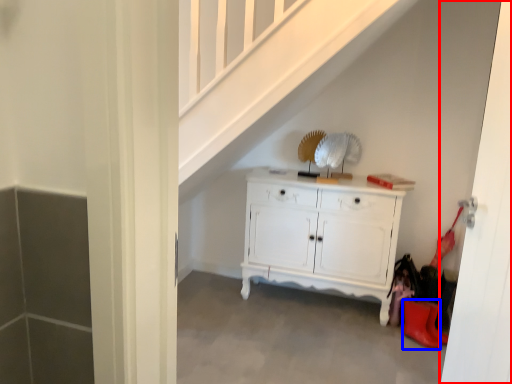
Question: Among these objects, which one is nearest to the camera, door (highlighted by a red box) or shoe (highlighted by a blue box)?

Choices:
 (A) door
 (B) shoe

Answer: (A)